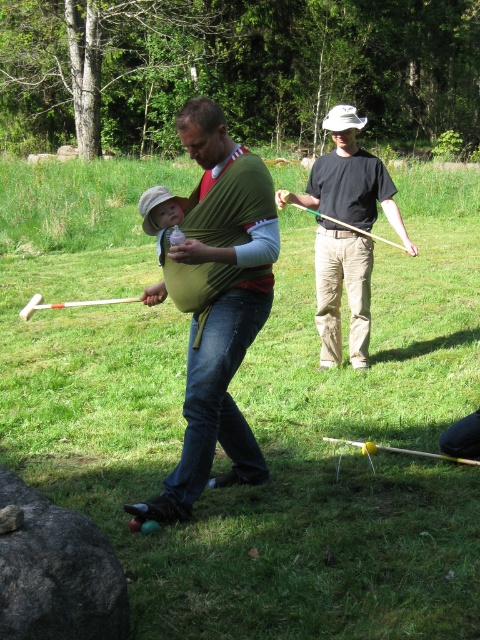
You are a photographer standing at the edge of the field. You want to take a photo of the green fabric baby carrier at center and the black cotton shirt at center. The camera can only focus on objects within a 2.5 meter range. Will both objects be in focus?

The green fabric baby carrier at center is 2.46 meters away from the black cotton shirt at center. Since the distance between them is within the camera focus range of 2.5 meters, both objects will be in focus.

You are a photographer trying to capture a clear photo of both the green fabric baby carrier at center and the black cotton shirt at center. Since you want to focus on the baby carrier first, which object should you place on the left side of your camera frame?

The green fabric baby carrier at center should be placed on the left side of your camera frame because it is already positioned on the left side of the black cotton shirt at center in the scene.

You are a photographer standing in the grassy field and want to take a picture of the man holding the baby in the green fabric baby carrier at center and the black cotton shirt at center. Which object is taller in the image?

The green fabric baby carrier at center is taller than the black cotton shirt at center.